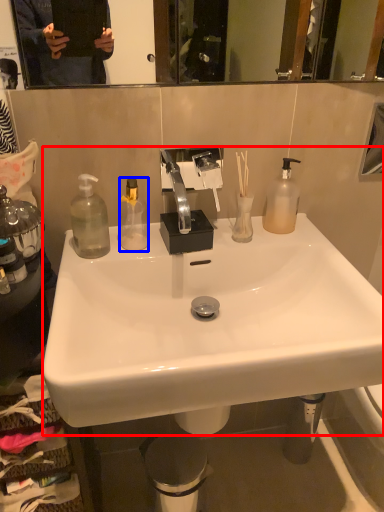
Question: Among these objects, which one is farthest to the camera, sink (highlighted by a red box) or bottle (highlighted by a blue box)?

Choices:
 (A) sink
 (B) bottle

Answer: (B)